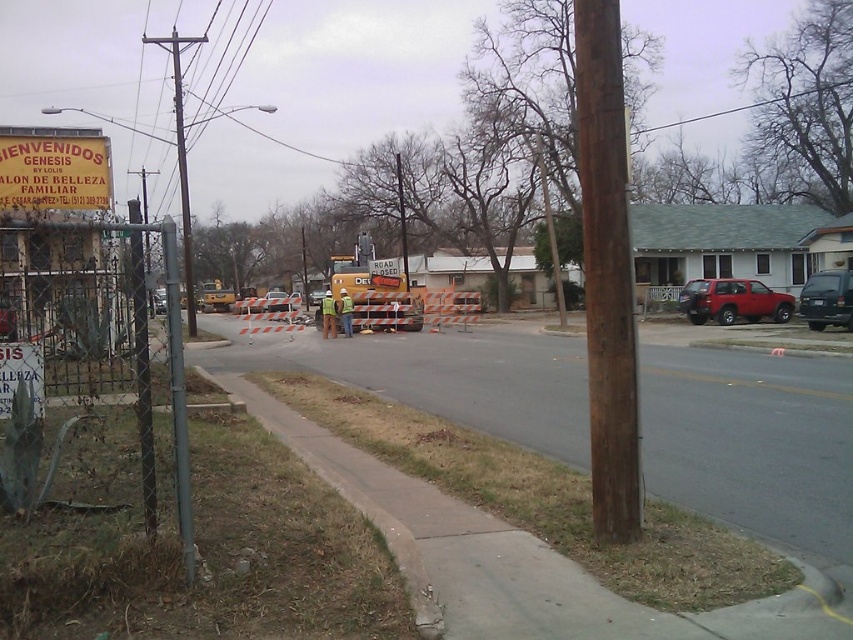
Question: Among these points, which one is farthest from the camera?

Choices:
 (A) (73, 168)
 (B) (843, 308)
 (C) (749, 284)
 (D) (350, 326)

Answer: (D)

Question: Does gray asphalt road at center have a lesser width compared to yellow construction vehicle at center?

Choices:
 (A) no
 (B) yes

Answer: (A)

Question: Which of the following is the closest to the observer?

Choices:
 (A) (215, 310)
 (B) (701, 285)
 (C) (184, 196)

Answer: (B)

Question: Among these objects, which one is nearest to the camera?

Choices:
 (A) brown wooden pole at center
 (B) brown wooden telegraph pole at left
 (C) green reflective vest at center
 (D) yellow matte sign at upper left

Answer: (A)

Question: Is matte red suv at right smaller than brown wooden telegraph pole at left?

Choices:
 (A) yes
 (B) no

Answer: (A)

Question: From the image, what is the correct spatial relationship of matte red suv at right in relation to green reflective safety vest at center?

Choices:
 (A) left
 (B) right

Answer: (B)